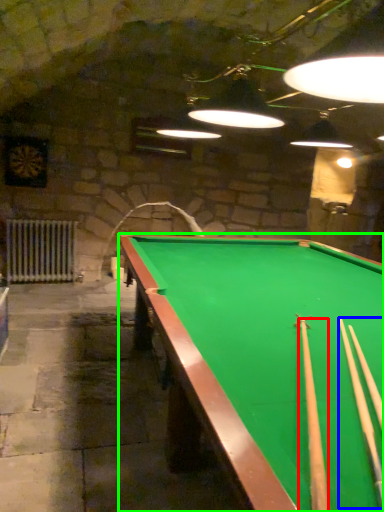
Question: Which object is positioned farthest from cue (highlighted by a red box)? Select from cue (highlighted by a blue box) and billiard table (highlighted by a green box).

Choices:
 (A) cue
 (B) billiard table

Answer: (B)